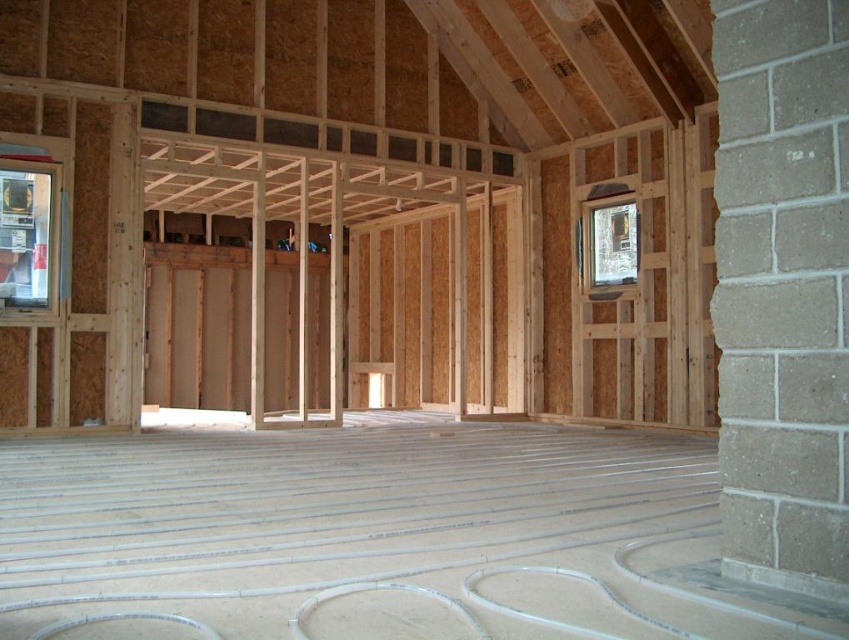
Does point (29, 230) come closer to viewer compared to point (637, 218)?

Yes, point (29, 230) is closer to viewer.

Is point (20, 307) positioned before point (593, 257)?

Yes, point (20, 307) is closer to viewer.

Locate an element on the screen. The image size is (849, 640). clear glass window at left is located at coordinates (25, 236).